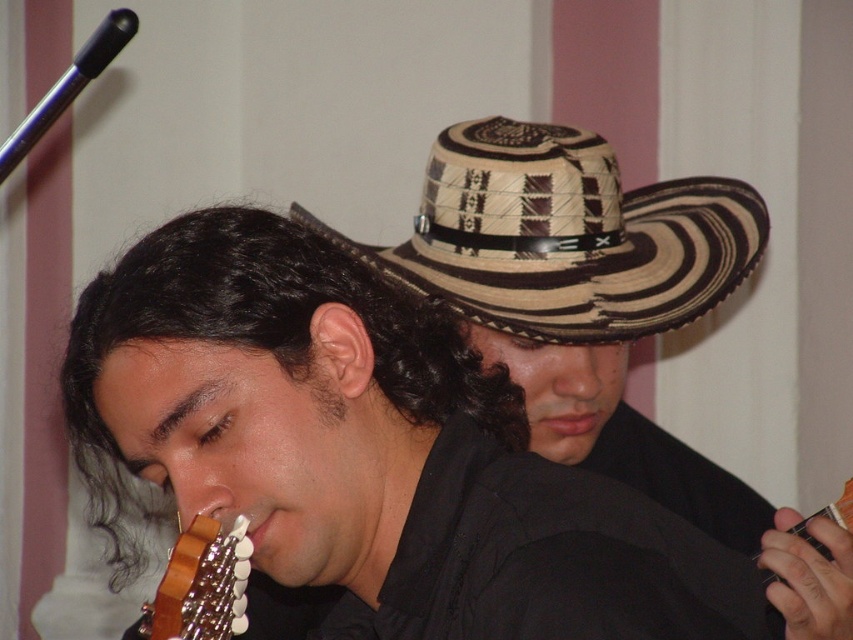
You are a photographer setting up for a concert. You need to place a microphone stand between the wooden acoustic guitar at lower left and the wooden acoustic guitar at lower right. According to the scene description, where should you position the microphone stand?

The wooden acoustic guitar at lower left is located below the wooden acoustic guitar at lower right, so the microphone stand should be placed between them vertically, positioning it above the wooden acoustic guitar at lower left and below the wooden acoustic guitar at lower right.

You are a photographer trying to capture both the brown woven straw cowboy hat at upper center and the wooden acoustic guitar at lower left in a single shot. Given their sizes, which object will appear bigger in the photo?

The brown woven straw cowboy hat at upper center will appear bigger in the photo because it is larger in size than the wooden acoustic guitar at lower left.